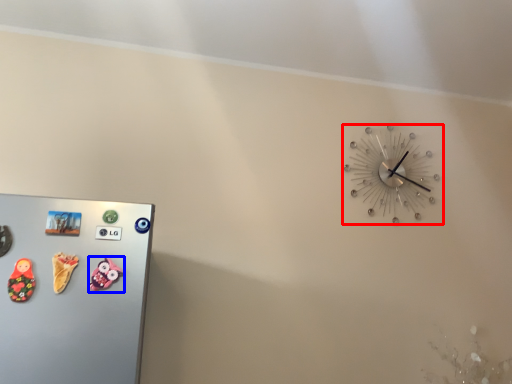
Question: Which point is further to the camera, wall clock (highlighted by a red box) or toy (highlighted by a blue box)?

Choices:
 (A) wall clock
 (B) toy

Answer: (A)